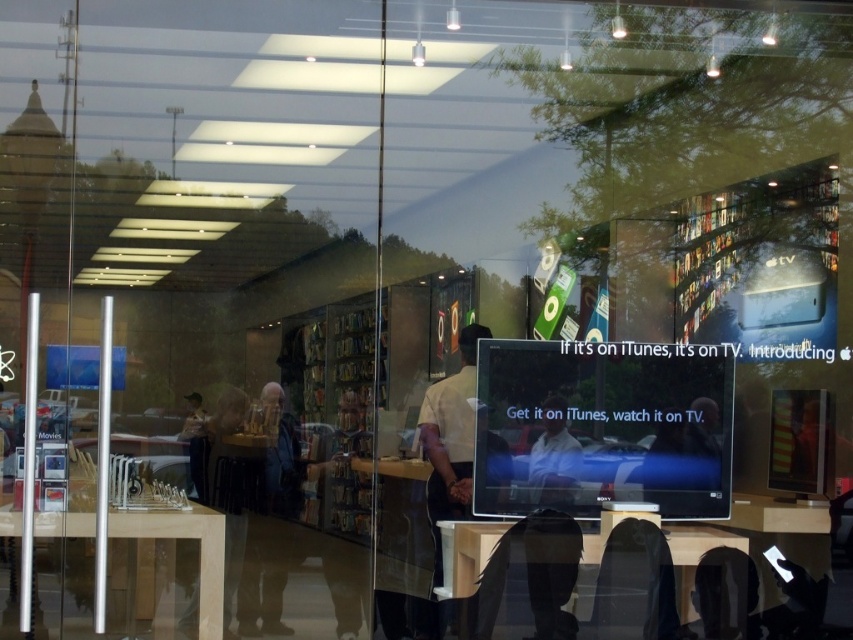
Question: Can you confirm if matte black table at lower center is positioned below light brown wooden table at left?

Choices:
 (A) no
 (B) yes

Answer: (B)

Question: Is matte black table at lower center wider than light brown wooden table at left?

Choices:
 (A) no
 (B) yes

Answer: (A)

Question: Is matte black table at lower center bigger than light brown wooden table at left?

Choices:
 (A) no
 (B) yes

Answer: (A)

Question: Which object appears farthest from the camera in this image?

Choices:
 (A) matte black table at lower center
 (B) light brown wooden table at left

Answer: (B)